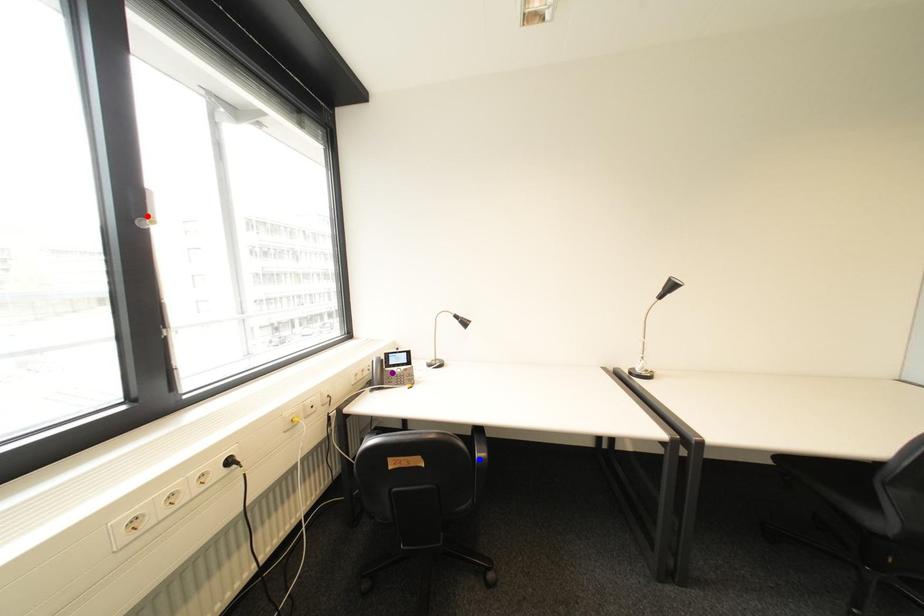
Order these from nearest to farthest:
- red point
- blue point
- purple point

1. red point
2. blue point
3. purple point